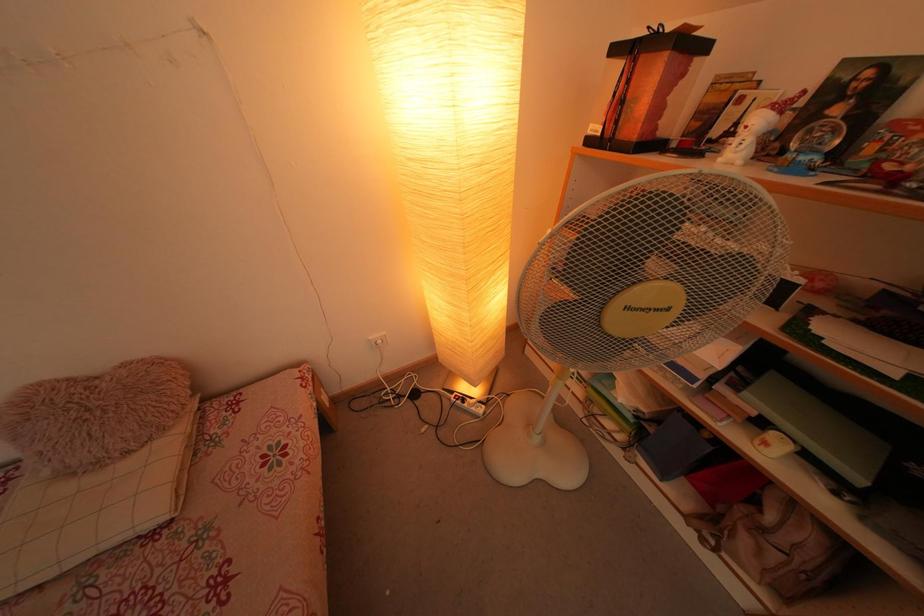
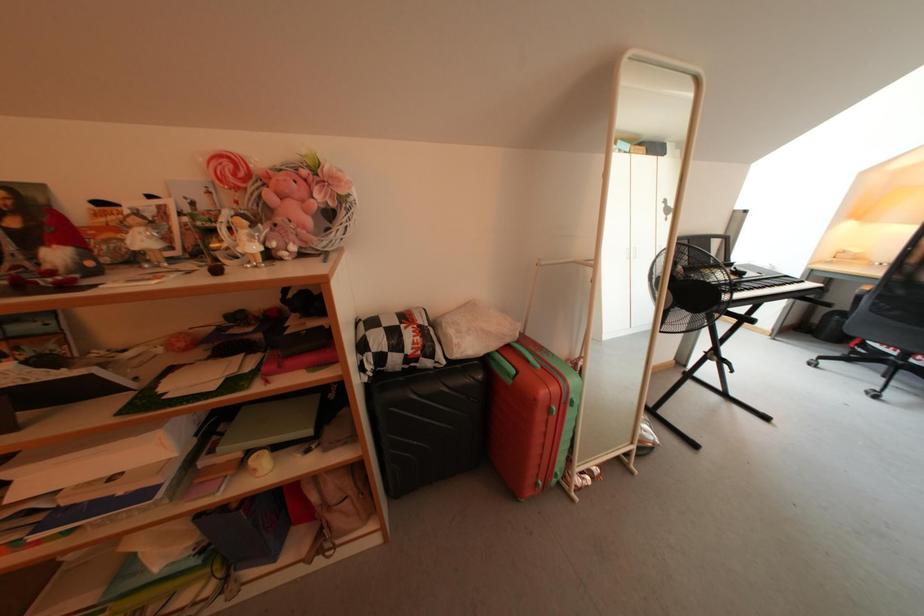
Question: How did the camera likely rotate?

Choices:
 (A) Left
 (B) Right
 (C) Up
 (D) Down

Answer: (B)